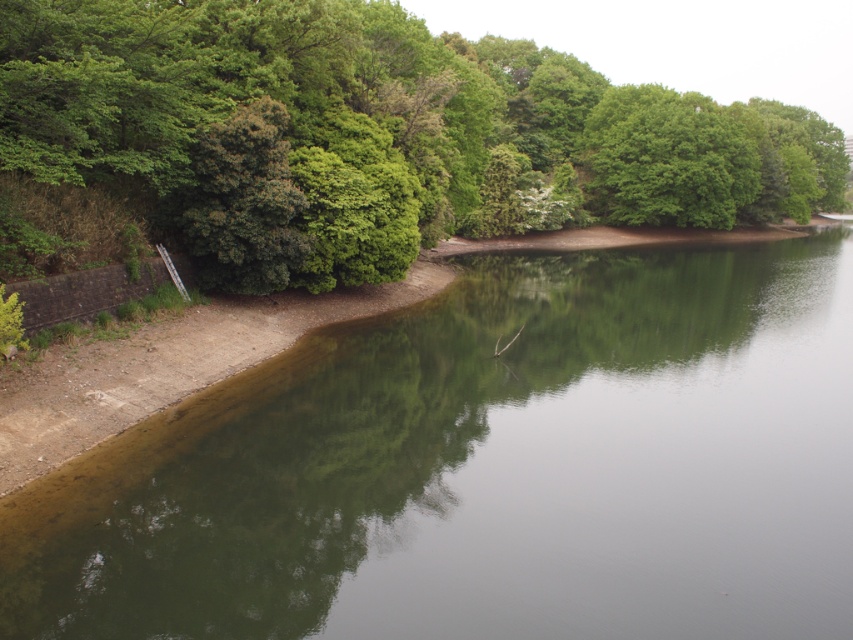
Question: Which of the following is the farthest from the observer?

Choices:
 (A) (677, 532)
 (B) (16, 432)
 (C) (718, 211)
 (D) (482, 80)

Answer: (C)

Question: Where is green leafy tree at upper left located in relation to green leafy tree at upper center in the image?

Choices:
 (A) below
 (B) above

Answer: (B)

Question: Which of the following is the closest to the observer?

Choices:
 (A) (618, 134)
 (B) (50, 545)

Answer: (B)

Question: Is green reflective water at center below green leafy tree at upper center?

Choices:
 (A) yes
 (B) no

Answer: (A)

Question: Which of these objects is positioned farthest from the green leafy tree at upper center?

Choices:
 (A) green leafy tree at upper left
 (B) green reflective water at center

Answer: (B)

Question: Can you confirm if green reflective water at center is smaller than green leafy tree at upper center?

Choices:
 (A) no
 (B) yes

Answer: (B)